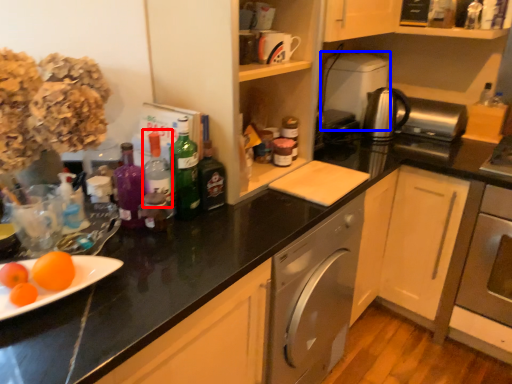
Question: Which object appears farthest to the camera in this image, bottle (highlighted by a red box) or appliance (highlighted by a blue box)?

Choices:
 (A) bottle
 (B) appliance

Answer: (B)